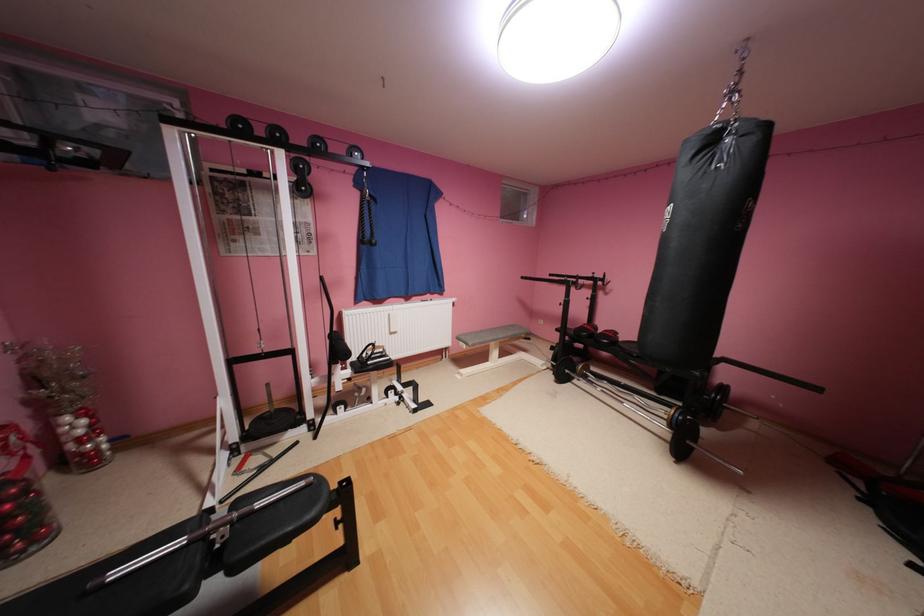
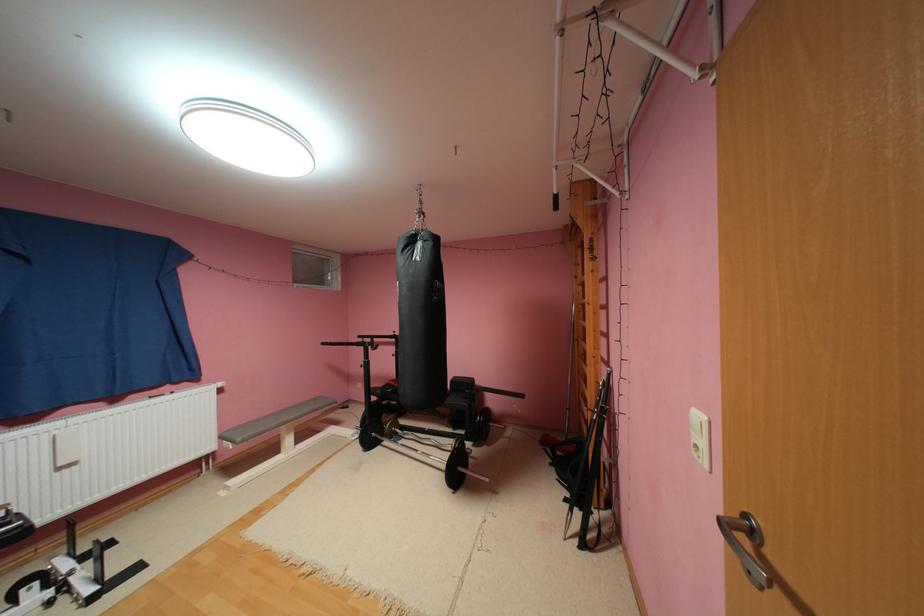
Where in the second image is the point corresponding to (x=600, y=275) from the first image?

(400, 334)